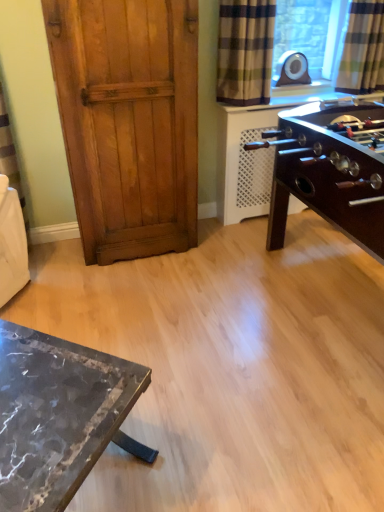
Locate an element on the screen. The height and width of the screenshot is (512, 384). free point above marble table at lower left (from a real-world perspective) is located at coordinates (41, 391).